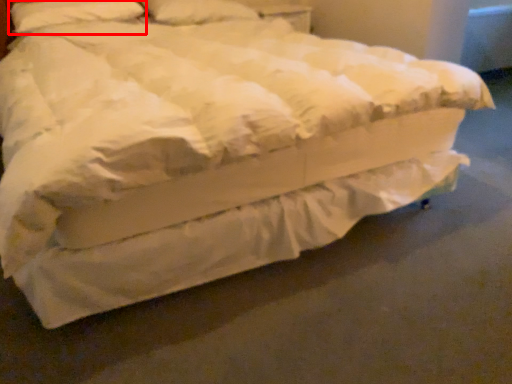
Question: From the image's perspective, where is pillow (annotated by the red box) located relative to pillow?

Choices:
 (A) below
 (B) above

Answer: (A)